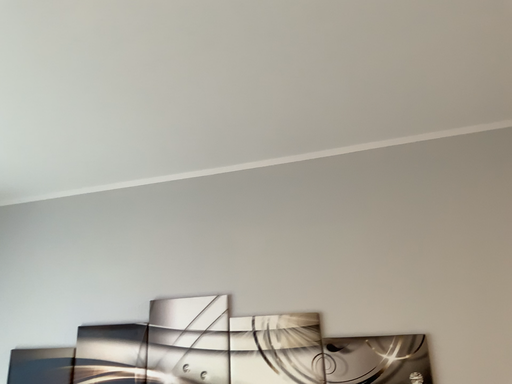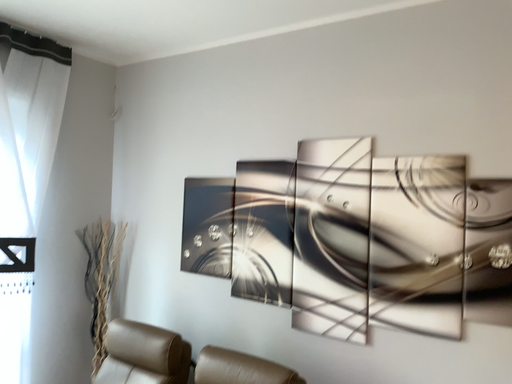
Question: Which way did the camera rotate in the video?

Choices:
 (A) rotated right
 (B) rotated left

Answer: (B)